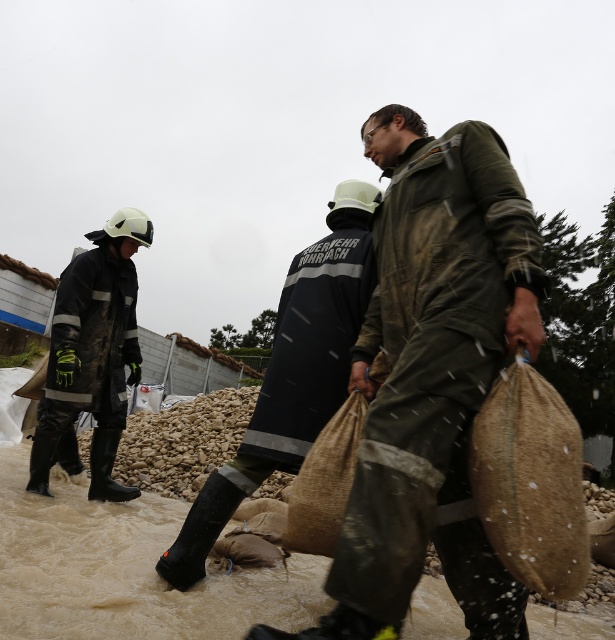
Between green matte jacket at center and burlap sack at lower right, which one has less height?

burlap sack at lower right

Can you confirm if green matte jacket at center is positioned to the left of burlap sack at lower right?

Correct, you'll find green matte jacket at center to the left of burlap sack at lower right.

Does point (514, 282) lie in front of point (568, 557)?

That is False.

Locate an element on the screen. The image size is (615, 640). green matte jacket at center is located at coordinates (432, 372).

Between green matte jacket at center and rubberized black boots at left, which one is positioned lower?

rubberized black boots at left

Does green matte jacket at center have a lesser height compared to rubberized black boots at left?

Yes.

Locate an element on the screen. green matte jacket at center is located at coordinates (432, 372).

Identify the location of green matte jacket at center. (432, 372).

Who is positioned more to the left, dark blue uniform at center or burlap sack at lower right?

dark blue uniform at center

What do you see at coordinates (292, 372) in the screenshot? This screenshot has width=615, height=640. I see `dark blue uniform at center` at bounding box center [292, 372].

At what (x,y) coordinates should I click in order to perform the action: click on dark blue uniform at center. Please return your answer as a coordinate pair (x, y). Looking at the image, I should click on (292, 372).